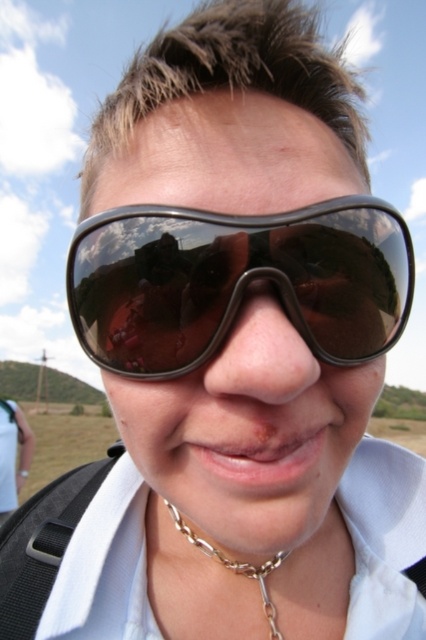
Does black matte goggles at center lie behind gold chain necklace at lower center?

No, black matte goggles at center is in front of gold chain necklace at lower center.

Does black matte goggles at center appear on the left side of gold chain necklace at lower center?

Incorrect, black matte goggles at center is not on the left side of gold chain necklace at lower center.

Who is more forward, (314,209) or (204,552)?

Point (314,209) is in front.

The height and width of the screenshot is (640, 426). I want to click on black matte goggles at center, so click(236, 282).